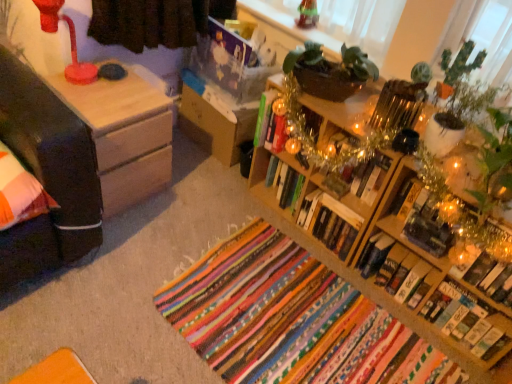
Where is `free space in front of hardcover book at center-right, the 2th book viewed from the left`? Image resolution: width=512 pixels, height=384 pixels. free space in front of hardcover book at center-right, the 2th book viewed from the left is located at coordinates point(329,274).